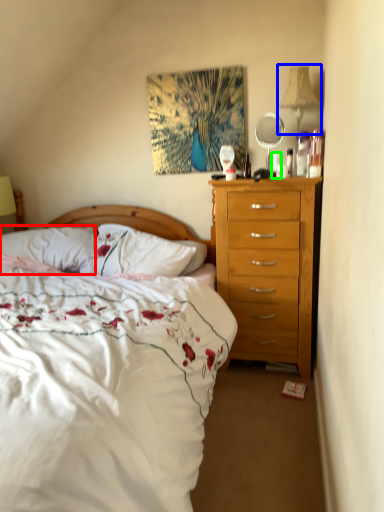
Question: Estimate the real-world distances between objects in this image. Which object is closer to pillow (highlighted by a red box), bedside lamp (highlighted by a blue box) or coffee cup (highlighted by a green box)?

Choices:
 (A) bedside lamp
 (B) coffee cup

Answer: (B)